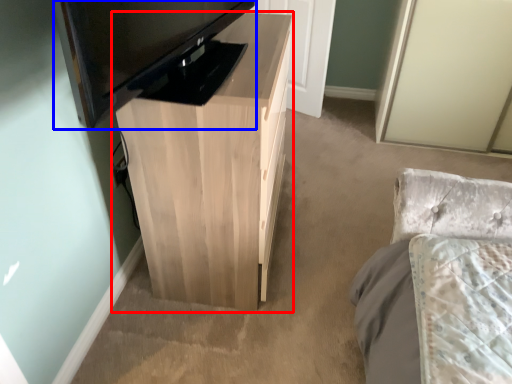
Question: Which of the following is the closest to the observer, table (highlighted by a red box) or television (highlighted by a blue box)?

Choices:
 (A) table
 (B) television

Answer: (B)